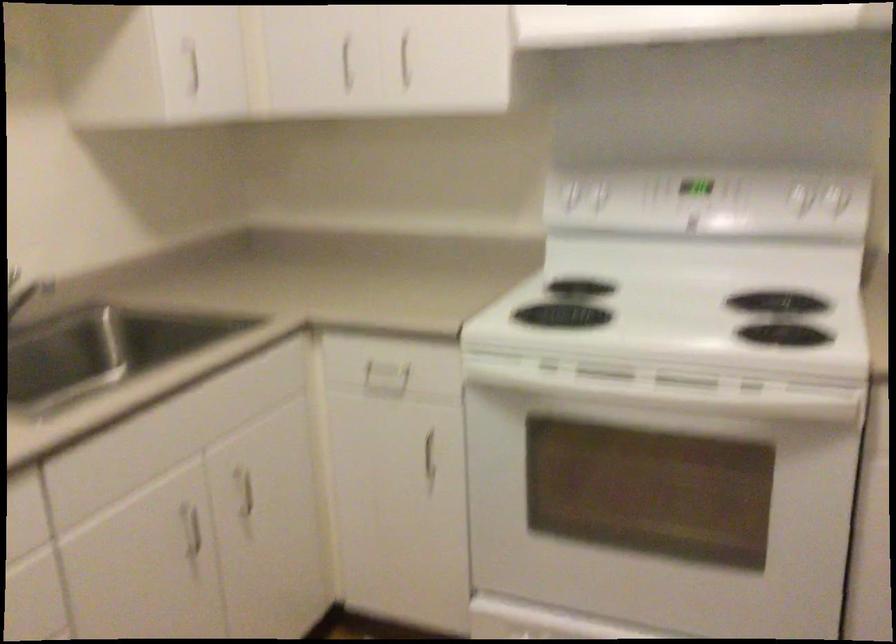
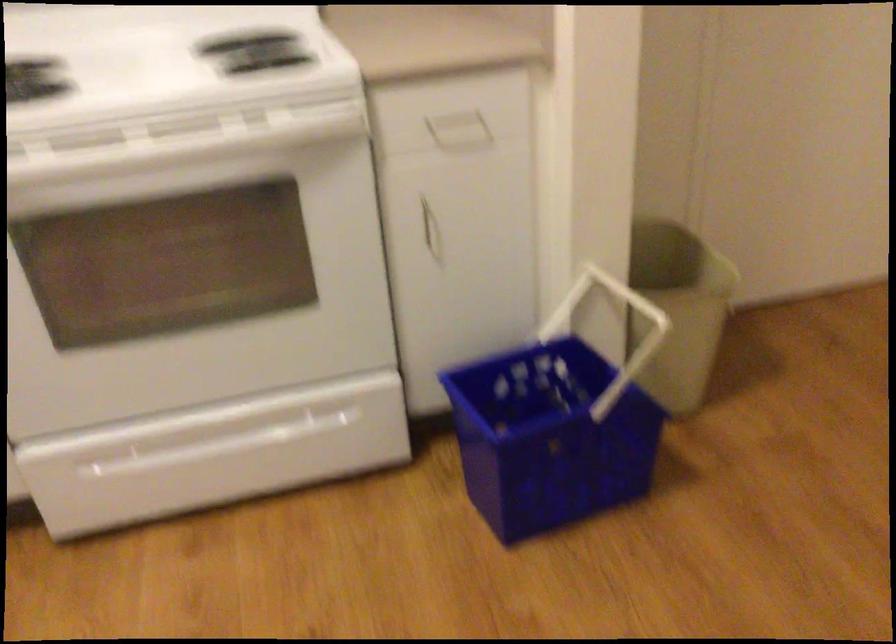
The images are taken continuously from a first-person perspective. In which direction is your viewpoint rotating?

The rotation direction of the camera is right-down.